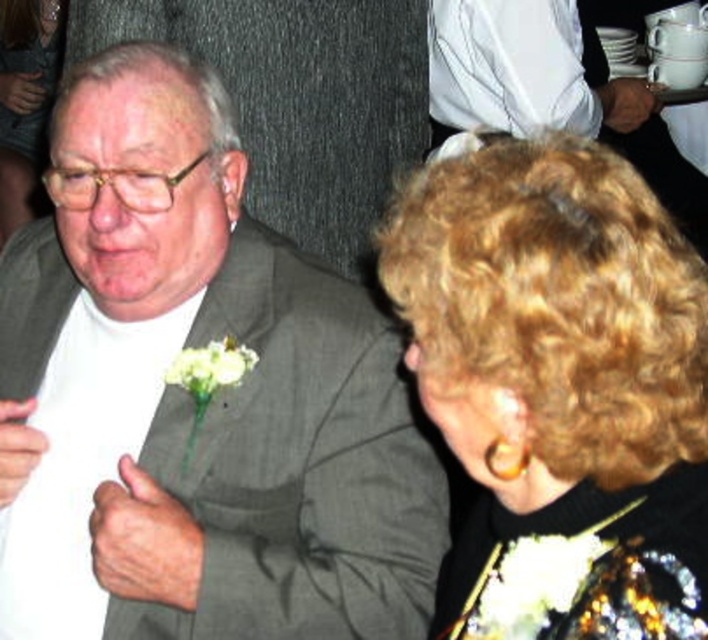
In the scene shown: You are a photographer setting up for a formal event. You need to ensure that the matte gray suit at center and the white matte flower at center are both visible in the frame. Given that the camera has a fixed focal length, which object should you prioritize positioning closer to the camera to ensure both are in focus?

The matte gray suit at center is wider than the white matte flower at center, so positioning the wider matte gray suit at center closer to the camera will help ensure both are in focus.

You are a photographer adjusting your camera to capture the interaction between the two people. You notice the curly hair at upper right and the shiny gold necklace at upper center. Which object should you focus on first if you want to prioritize the one that is taller?

The shiny gold necklace at upper center is taller than the curly hair at upper right, so you should focus on the shiny gold necklace at upper center first.

You are standing in front of the two people in the image. You want to place a small gift between them so that it is equally accessible to both. Given the positions of point (426, 253) and point (236, 358), which point should you choose to ensure the gift is closer to both individuals?

Point (426, 253) is closer to the viewer than point (236, 358). To place the gift equally accessible to both individuals, you should choose the point that is equidistant from both people. However, since the description states that point (426, 253) is closer to the viewer, placing the gift there would make it closer to the person on the left and farther from the right. Conversely, placing it at point (236, 358) would be farther from the left but closer to the right. Since the question asks for equal